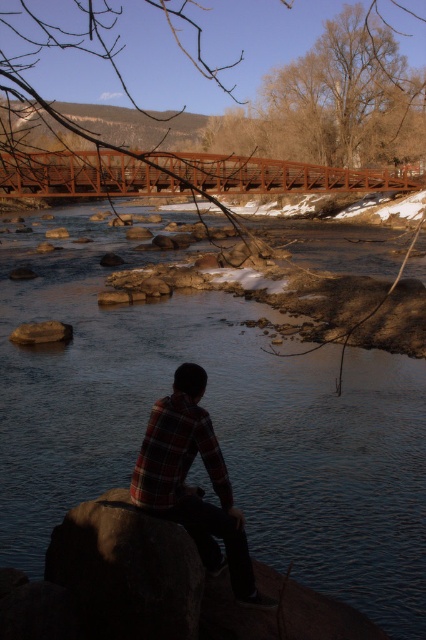
You are trying to decide whether to place a small camping stool next to the dark gray stone boulder at center. Considering the space available, would the plaid fabric shirt at center interfere with placing the stool there?

The dark gray stone boulder at center might be wider than the plaid fabric shirt at center, so there might be enough space to place the stool without interference from the plaid fabric shirt at center.

You are a hiker who wants to take a photo of the plaid fabric shirt at center and the brown smooth rock at lower center. Which object should you focus on first if you want to capture both in the same frame without moving the camera?

The plaid fabric shirt at center should be focused on first because it is larger than the brown smooth rock at lower center, so adjusting focus to the larger object first ensures both will be in the frame.

You are a photographer trying to capture the plaid fabric shirt at center and the brown smooth rock at lower center in the same frame. Based on their relative sizes in the image, which object should you focus on first to ensure both are in focus?

The plaid fabric shirt at center is taller than the brown smooth rock at lower center, so you should focus on the plaid fabric shirt at center first to ensure both are in focus since it is larger and requires more attention in the frame.